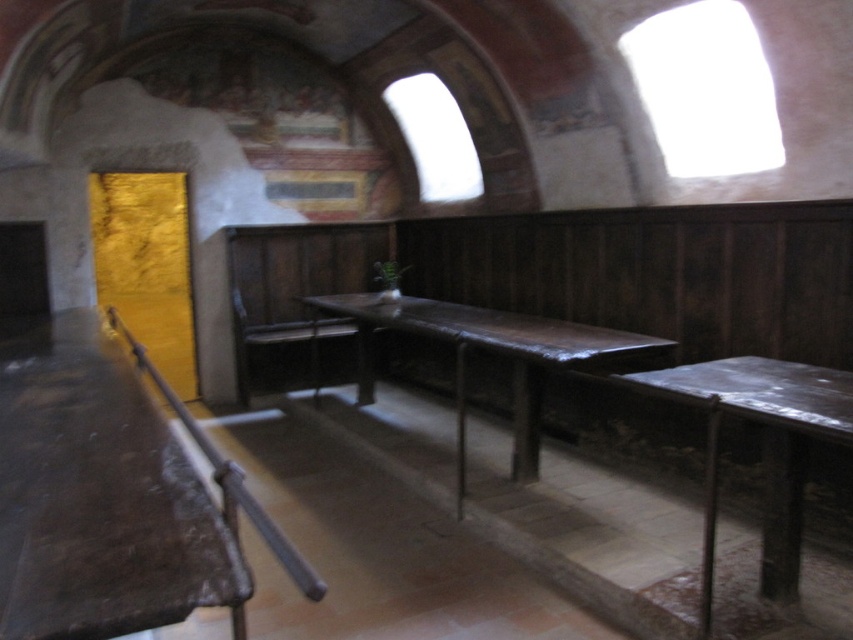
You are standing in the historical dining hall and need to place a small decorative item exactly halfway between point (x=74, y=385) and point (x=465, y=352). Given that the room has vaulted ceilings and wooden tables, will the halfway point be closer to the ceiling or the floor?

The halfway point between point (x=74, y=385) and point (x=465, y=352) would be closer to the floor because the first point is closer to the viewer, implying it is lower in elevation compared to the second point.

You are a guest entering the room and want to sit at the dark brown wooden table at left and the rustic wood table at center. Which table should you walk towards first if you want to reach the one on the left side of the room?

You should walk towards the dark brown wooden table at left first because it is located to the left of the rustic wood table at center, making it the one on the left side of the room.

You are standing in the room and want to place a 3.5 feet wide painting on the wall behind the dark brown wooden table at left. Can you fit it there without moving the table?

The dark brown wooden table at left is 3.49 feet away from the camera. Since the painting is 3.5 feet wide, it would be slightly wider than the distance from the table to the camera, so placing it there might not leave enough space. You might need to adjust the painting size or move the table for proper placement.